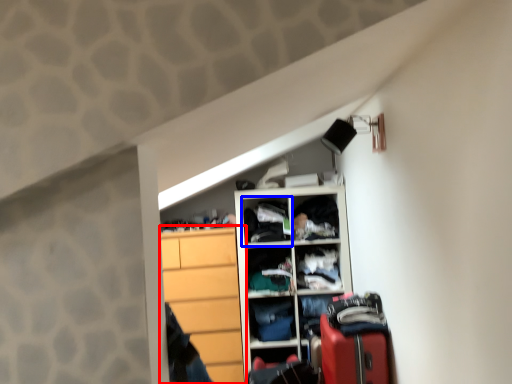
Question: Which of the following is the closest to the observer, cabinetry (highlighted by a red box) or cabinet (highlighted by a blue box)?

Choices:
 (A) cabinetry
 (B) cabinet

Answer: (A)